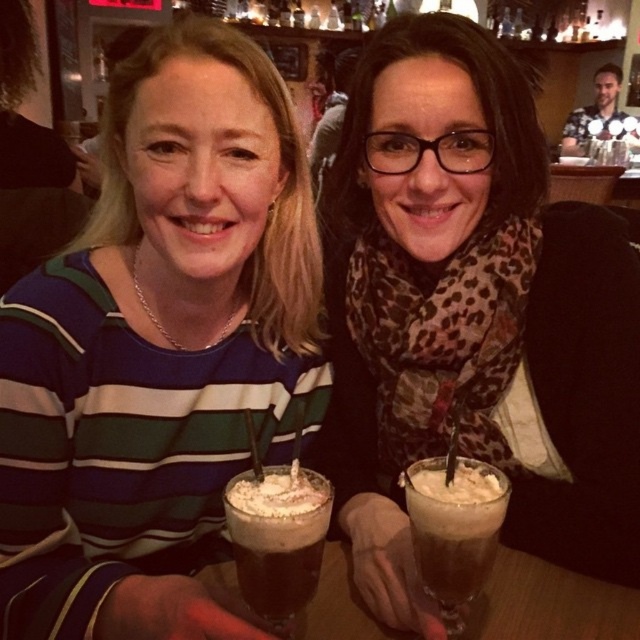
Question: From the image, what is the correct spatial relationship of green striped sweater at center in relation to dark brown foam at center?

Choices:
 (A) below
 (B) above

Answer: (B)

Question: Which object is farther from the camera taking this photo?

Choices:
 (A) dark brown foam at center
 (B) leopard print scarf at center
 (C) frothy brown liquid at center

Answer: (B)

Question: Where is leopard print scarf at center located in relation to dark brown foam at center in the image?

Choices:
 (A) right
 (B) left

Answer: (A)

Question: Which object is positioned farthest from the dark brown foam at center?

Choices:
 (A) leopard print scarf at center
 (B) frothy brown liquid at center

Answer: (A)

Question: Which object is farther from the camera taking this photo?

Choices:
 (A) frothy brown liquid at center
 (B) leopard print scarf at center

Answer: (B)

Question: Can you confirm if green striped sweater at center is wider than leopard print scarf at center?

Choices:
 (A) no
 (B) yes

Answer: (A)